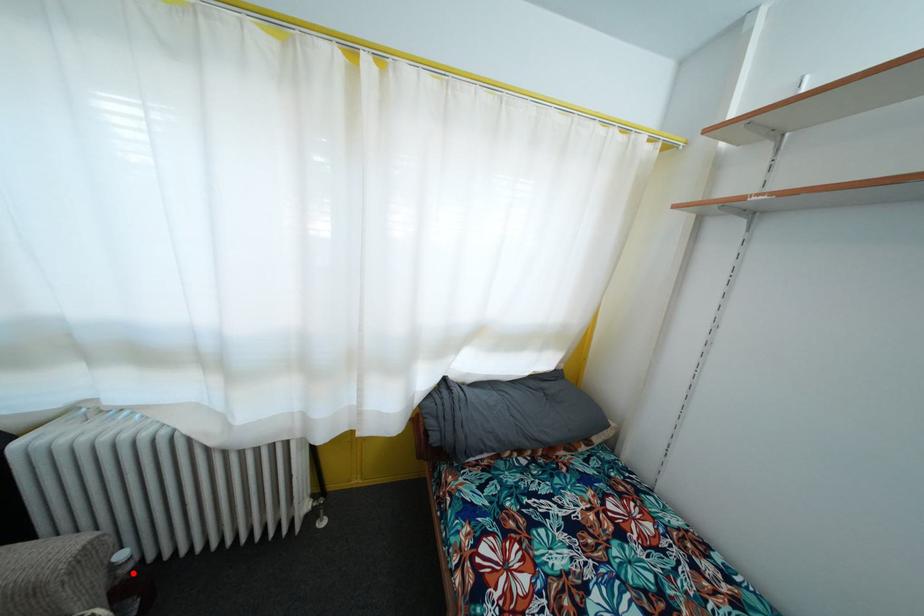
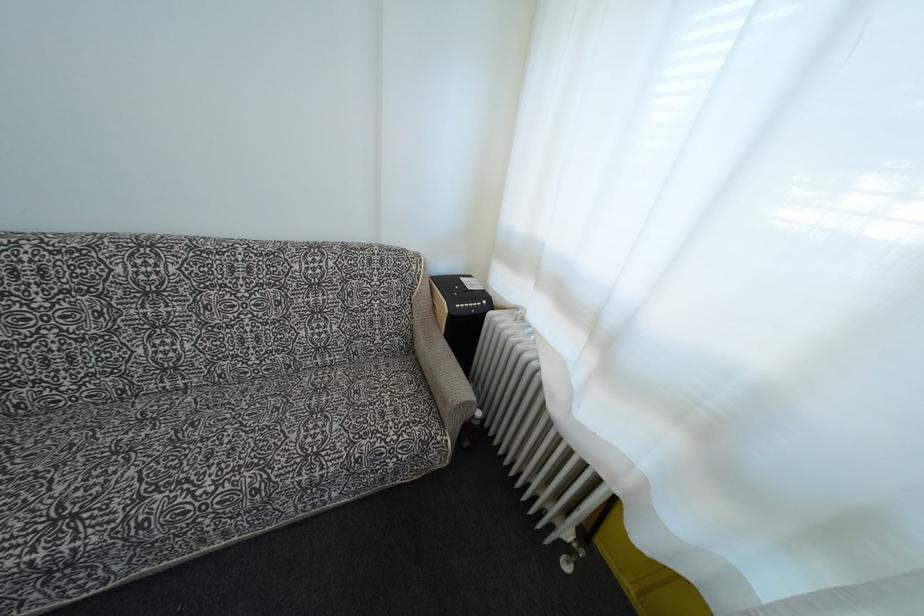
Question: I am providing you with two images of the same scene from different viewpoints. A red point is shown in image1. For the corresponding object point in image2, is it positioned nearer or farther from the camera?

Choices:
 (A) Nearer
 (B) Farther

Answer: (B)